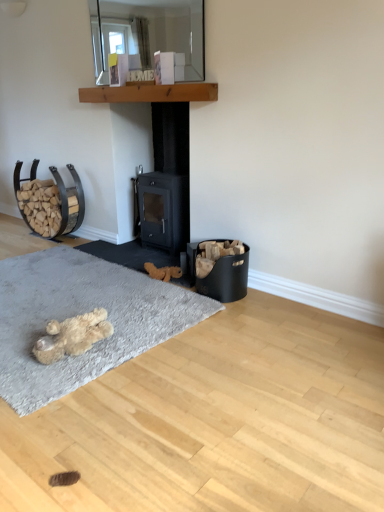
You are a GUI agent. You are given a task and a screenshot of the screen. Output one action in this format:
    pyautogui.click(x=<x>, y=<y>)
    Task: Click on the free point in front of brown plush toy at center, placed as the 1th animal when sorted from right to left
    The width and height of the screenshot is (384, 512).
    Given the screenshot: What is the action you would take?
    pyautogui.click(x=162, y=288)